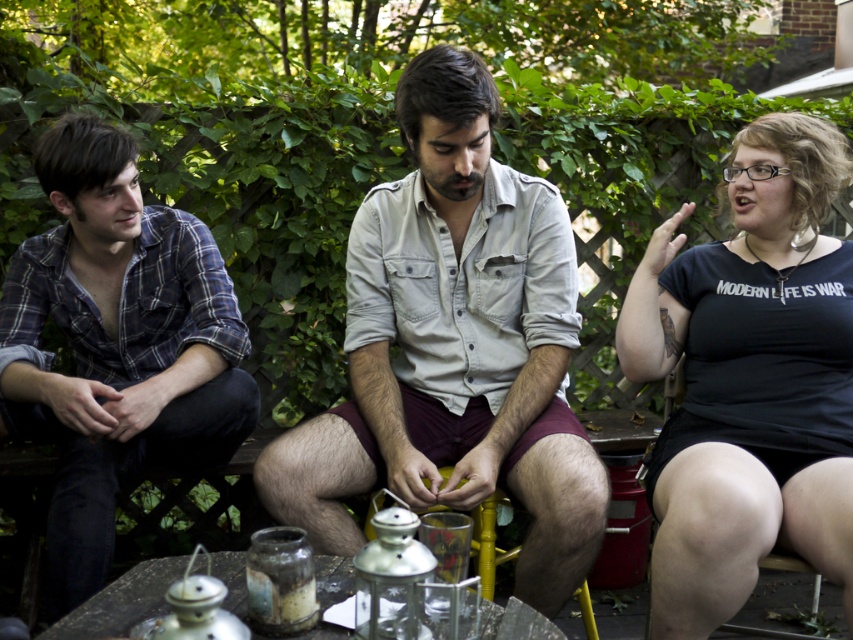
Is point (532, 228) more distant than point (32, 372)?

Yes, point (532, 228) is farther from viewer.

Based on the photo, can you confirm if light gray cotton shirt at center is taller than plaid cotton shirt at left?

Correct, light gray cotton shirt at center is much taller as plaid cotton shirt at left.

Is point (450, 237) positioned after point (125, 168)?

No.

Identify the location of light gray cotton shirt at center. (454, 346).

Does black matte shirt at right have a smaller size compared to metallic glass table at center?

No, black matte shirt at right is not smaller than metallic glass table at center.

Does black matte shirt at right have a larger size compared to metallic glass table at center?

Yes.

What do you see at coordinates (749, 380) in the screenshot?
I see `black matte shirt at right` at bounding box center [749, 380].

At what (x,y) coordinates should I click in order to perform the action: click on black matte shirt at right. Please return your answer as a coordinate pair (x, y). The width and height of the screenshot is (853, 640). Looking at the image, I should click on (749, 380).

Does light gray cotton shirt at center appear on the left side of black matte shirt at right?

Correct, you'll find light gray cotton shirt at center to the left of black matte shirt at right.

Who is higher up, light gray cotton shirt at center or black matte shirt at right?

light gray cotton shirt at center is above.

The width and height of the screenshot is (853, 640). Identify the location of light gray cotton shirt at center. tap(454, 346).

I want to click on light gray cotton shirt at center, so click(x=454, y=346).